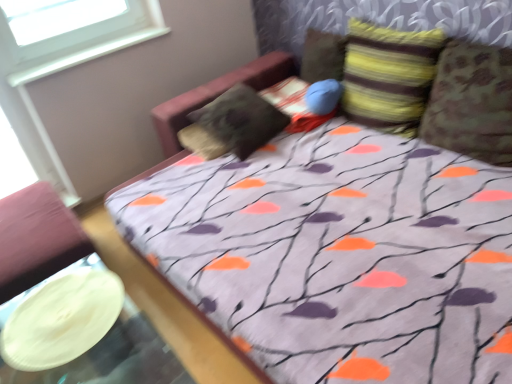
Question: From a real-world perspective, is white plastic window at upper left positioned over camouflage fabric pillow at right, the 4th pillow positioned from the left, based on gravity?

Choices:
 (A) yes
 (B) no

Answer: (A)

Question: Is white plastic window at upper left taller than camouflage fabric pillow at right, the 4th pillow positioned from the left?

Choices:
 (A) yes
 (B) no

Answer: (B)

Question: From a real-world perspective, is white plastic window at upper left under camouflage fabric pillow at right, which ranks as the 1th pillow in right-to-left order?

Choices:
 (A) yes
 (B) no

Answer: (B)

Question: Does white plastic window at upper left have a smaller size compared to camouflage fabric pillow at right, the 4th pillow positioned from the left?

Choices:
 (A) no
 (B) yes

Answer: (B)

Question: Is there a large distance between white plastic window at upper left and camouflage fabric pillow at right, which ranks as the 1th pillow in right-to-left order?

Choices:
 (A) yes
 (B) no

Answer: (A)

Question: From their relative heights in the image, would you say white glossy platter at lower left is taller or shorter than camouflage fabric pillow at right, the 4th pillow positioned from the left?

Choices:
 (A) short
 (B) tall

Answer: (A)

Question: From a real-world perspective, is white glossy platter at lower left physically located above or below camouflage fabric pillow at right, the 4th pillow positioned from the left?

Choices:
 (A) above
 (B) below

Answer: (B)

Question: In the image, is white glossy platter at lower left on the left side or the right side of camouflage fabric pillow at right, the 4th pillow positioned from the left?

Choices:
 (A) right
 (B) left

Answer: (B)

Question: Do you think white glossy platter at lower left is within camouflage fabric pillow at right, the 4th pillow positioned from the left, or outside of it?

Choices:
 (A) inside
 (B) outside

Answer: (B)

Question: In terms of size, does white plastic window at upper left appear bigger or smaller than camouflage fabric pillow at right, the 4th pillow positioned from the left?

Choices:
 (A) small
 (B) big

Answer: (A)

Question: From a real-world perspective, is white plastic window at upper left above or below camouflage fabric pillow at right, the 4th pillow positioned from the left?

Choices:
 (A) above
 (B) below

Answer: (A)

Question: Considering the positions of point (129, 29) and point (442, 142), is point (129, 29) closer or farther from the camera than point (442, 142)?

Choices:
 (A) closer
 (B) farther

Answer: (B)

Question: Considering the positions of white plastic window at upper left and camouflage fabric pillow at right, which ranks as the 1th pillow in right-to-left order, in the image, is white plastic window at upper left wider or thinner than camouflage fabric pillow at right, which ranks as the 1th pillow in right-to-left order,?

Choices:
 (A) wide
 (B) thin

Answer: (B)

Question: Is striped fabric pillow at upper right, positioned as the 3th pillow in left-to-right order, inside or outside of striped fabric pillow at upper center, which is the 3th pillow from right to left?

Choices:
 (A) outside
 (B) inside

Answer: (A)

Question: In terms of height, does striped fabric pillow at upper right, positioned as the 3th pillow in left-to-right order, look taller or shorter compared to striped fabric pillow at upper center, which is the 3th pillow from right to left?

Choices:
 (A) tall
 (B) short

Answer: (A)